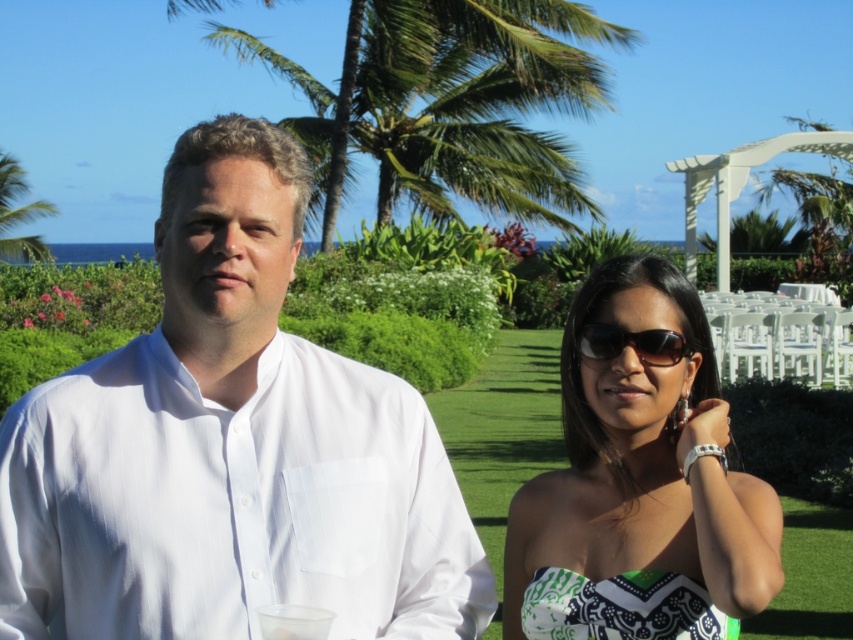
Question: Which is farther from the green leafy palm tree at upper center?

Choices:
 (A) transparent plastic cup at lower center
 (B) green printed fabric dress at lower right
 (C) black plastic sunglasses at center

Answer: (A)

Question: Among these objects, which one is nearest to the camera?

Choices:
 (A) transparent plastic cup at lower center
 (B) black plastic sunglasses at center
 (C) green leafy palm tree at upper left
 (D) green printed dress at center

Answer: (A)

Question: Can you confirm if green leafy palm tree at upper left is wider than black plastic sunglasses at center?

Choices:
 (A) yes
 (B) no

Answer: (A)

Question: Is green printed dress at center bigger than green leafy palm tree at upper center?

Choices:
 (A) no
 (B) yes

Answer: (A)

Question: Is black plastic sunglasses at center closer to the viewer compared to transparent plastic cup at lower center?

Choices:
 (A) yes
 (B) no

Answer: (B)

Question: Which object is closer to the camera taking this photo?

Choices:
 (A) green printed fabric dress at lower right
 (B) green leafy palm tree at upper center

Answer: (A)